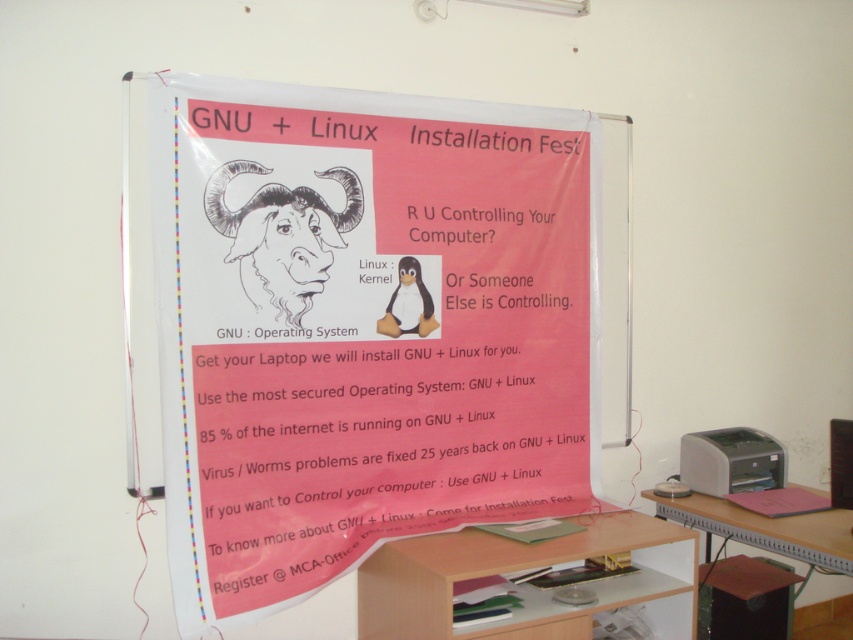
You are organizing a tech fair and need to ensure that all promotional materials are displayed properly. The black line drawing goat at center and the white plastic printer at lower right are part of a poster. Which object takes up more space on the poster?

The black line drawing goat at center is larger in size than the white plastic printer at lower right, so it takes up more space on the poster.